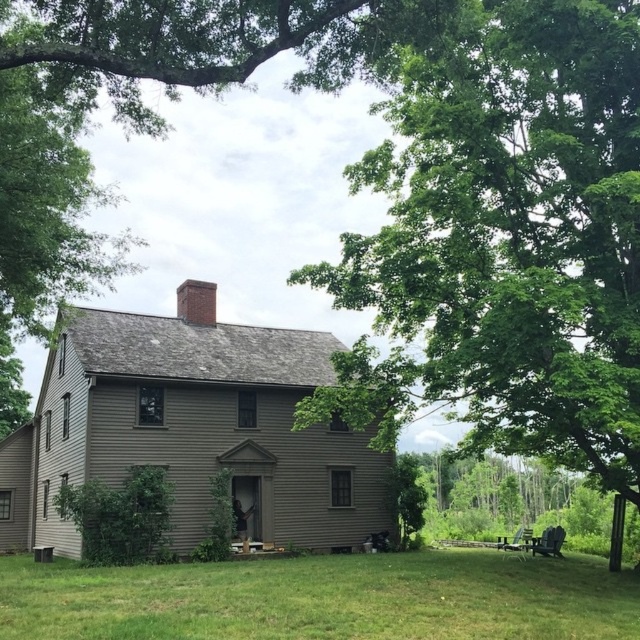
Does green grass at lower center have a greater height compared to red brick chimney at upper center?

Yes.

Can you confirm if green grass at lower center is positioned to the left of red brick chimney at upper center?

Incorrect, green grass at lower center is not on the left side of red brick chimney at upper center.

You are a GUI agent. You are given a task and a screenshot of the screen. Output one action in this format:
    pyautogui.click(x=<x>, y=<y>)
    Task: Click on the green grass at lower center
    
    Given the screenshot: What is the action you would take?
    pyautogui.click(x=323, y=598)

Does green leafy tree at center have a smaller size compared to red brick chimney at upper center?

Actually, green leafy tree at center might be larger than red brick chimney at upper center.

Who is more forward, (573,330) or (195,291)?

Point (573,330)

I want to click on green leafy tree at center, so click(506, 241).

Who is more forward, (516, 32) or (179, 588)?

Positioned in front is point (179, 588).

Between green leafy tree at center and green grass at lower center, which one has less height?

Standing shorter between the two is green grass at lower center.

Where is `green leafy tree at center`? This screenshot has height=640, width=640. green leafy tree at center is located at coordinates (506, 241).